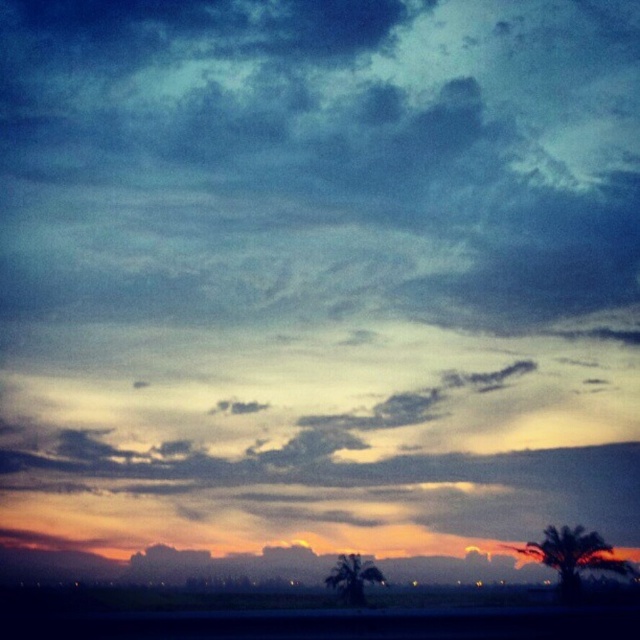
Who is positioned more to the left, green leafy palm tree at lower right or green leafy palm tree at lower center?

From the viewer's perspective, green leafy palm tree at lower center appears more on the left side.

Between point (589, 561) and point (330, 573), which one is positioned behind?

Point (330, 573)

The image size is (640, 640). In order to click on green leafy palm tree at lower right in this screenshot , I will do tap(573, 556).

In order to click on green leafy palm tree at lower right in this screenshot , I will do `click(573, 556)`.